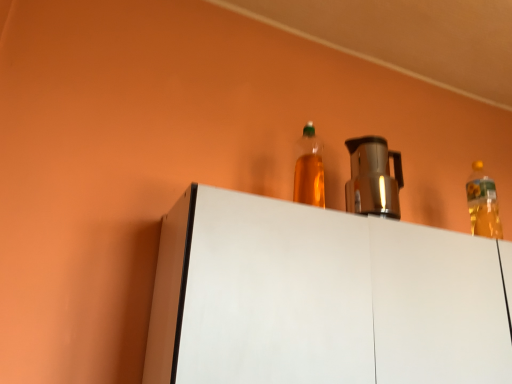
Measure the distance between point [480,272] and camera.

A distance of 3.48 feet exists between point [480,272] and camera.

Where is `translucent yellow bottle at upper right, acting as the first bottle starting from the right`? The image size is (512, 384). translucent yellow bottle at upper right, acting as the first bottle starting from the right is located at coordinates (483, 204).

The height and width of the screenshot is (384, 512). What are the coordinates of `translucent plastic bottle at upper center, placed as the second bottle when sorted from right to left` in the screenshot? It's located at (309, 170).

You are a GUI agent. You are given a task and a screenshot of the screen. Output one action in this format:
    pyautogui.click(x=<x>, y=<y>)
    Task: Click on the metallic silver coffee pot at center
    This screenshot has width=512, height=384.
    Given the screenshot: What is the action you would take?
    [373, 178]

Does white matte cabinet at upper center have a greater height compared to metallic silver coffee pot at center?

Indeed, white matte cabinet at upper center has a greater height compared to metallic silver coffee pot at center.

Does point (202, 262) come farther from viewer compared to point (383, 180)?

No, (202, 262) is in front of (383, 180).

The height and width of the screenshot is (384, 512). Find the location of `appliance above the white matte cabinet at upper center (from the image's perspective)`. appliance above the white matte cabinet at upper center (from the image's perspective) is located at coordinates (373, 178).

Does metallic silver coffee pot at center contain translucent plastic bottle at upper center, which is the 1th bottle from front to back?

Definitely not — translucent plastic bottle at upper center, which is the 1th bottle from front to back, is not inside metallic silver coffee pot at center.

Considering the relative sizes of metallic silver coffee pot at center and translucent plastic bottle at upper center, the first bottle in the left-to-right sequence, in the image provided, is metallic silver coffee pot at center smaller than translucent plastic bottle at upper center, the first bottle in the left-to-right sequence,?

Actually, metallic silver coffee pot at center might be larger than translucent plastic bottle at upper center, the first bottle in the left-to-right sequence.

Which of these two, metallic silver coffee pot at center or translucent plastic bottle at upper center, placed as the second bottle when sorted from right to left, stands shorter?

Standing shorter between the two is metallic silver coffee pot at center.

Is translucent plastic bottle at upper center, the 2th bottle viewed from the back, not inside metallic silver coffee pot at center?

Yes.

From a real-world perspective, is translucent plastic bottle at upper center, the first bottle in the left-to-right sequence, positioned above or below metallic silver coffee pot at center?

In terms of real-world spatial position, translucent plastic bottle at upper center, the first bottle in the left-to-right sequence, is above metallic silver coffee pot at center.

Is translucent plastic bottle at upper center, the 2th bottle viewed from the back, facing towards metallic silver coffee pot at center?

No, translucent plastic bottle at upper center, the 2th bottle viewed from the back, is not aimed at metallic silver coffee pot at center.

Where is `appliance located below the translucent plastic bottle at upper center, which is the 1th bottle from front to back (from the image's perspective)`? The image size is (512, 384). appliance located below the translucent plastic bottle at upper center, which is the 1th bottle from front to back (from the image's perspective) is located at coordinates (373, 178).

Who is taller, metallic silver coffee pot at center or white matte cabinet at upper center?

With more height is white matte cabinet at upper center.

From a real-world perspective, which is physically above, metallic silver coffee pot at center or white matte cabinet at upper center?

metallic silver coffee pot at center.

Locate an element on the screen. The image size is (512, 384). furniture that appears below the metallic silver coffee pot at center (from the image's perspective) is located at coordinates tap(320, 298).

Is metallic silver coffee pot at center a part of translucent yellow bottle at upper right, which is the 2th bottle in left-to-right order?

No, metallic silver coffee pot at center is located outside of translucent yellow bottle at upper right, which is the 2th bottle in left-to-right order.

How distant is translucent yellow bottle at upper right, the 1th bottle viewed from the back, from metallic silver coffee pot at center?

translucent yellow bottle at upper right, the 1th bottle viewed from the back, and metallic silver coffee pot at center are 23.85 inches apart.

Locate an element on the screen. The height and width of the screenshot is (384, 512). appliance on the left of the translucent yellow bottle at upper right, acting as the first bottle starting from the right is located at coordinates [x=373, y=178].

Is translucent yellow bottle at upper right, the second bottle positioned from the front, bigger or smaller than metallic silver coffee pot at center?

Considering their sizes, translucent yellow bottle at upper right, the second bottle positioned from the front, takes up less space than metallic silver coffee pot at center.

Could you tell me if translucent plastic bottle at upper center, which is the 1th bottle from front to back, is facing white matte cabinet at upper center?

No, translucent plastic bottle at upper center, which is the 1th bottle from front to back, is not turned towards white matte cabinet at upper center.

Looking at this image, does translucent plastic bottle at upper center, the 2th bottle viewed from the back, appear on the left side of white matte cabinet at upper center?

Yes, translucent plastic bottle at upper center, the 2th bottle viewed from the back, is to the left of white matte cabinet at upper center.

Is white matte cabinet at upper center completely or partially inside translucent plastic bottle at upper center, placed as the second bottle when sorted from right to left?

No, white matte cabinet at upper center is located outside of translucent plastic bottle at upper center, placed as the second bottle when sorted from right to left.

From a real-world perspective, which object rests below the other?

white matte cabinet at upper center, from a real-world perspective.

Could you tell me if translucent plastic bottle at upper center, the 2th bottle viewed from the back, is facing translucent yellow bottle at upper right, acting as the first bottle starting from the right?

No, translucent plastic bottle at upper center, the 2th bottle viewed from the back, is not turned towards translucent yellow bottle at upper right, acting as the first bottle starting from the right.

Which of these two, translucent plastic bottle at upper center, placed as the second bottle when sorted from right to left, or translucent yellow bottle at upper right, the second bottle positioned from the front, is bigger?

translucent plastic bottle at upper center, placed as the second bottle when sorted from right to left.

Is translucent plastic bottle at upper center, which is the 1th bottle from front to back, surrounding translucent yellow bottle at upper right, the 1th bottle viewed from the back?

No, translucent plastic bottle at upper center, which is the 1th bottle from front to back, does not contain translucent yellow bottle at upper right, the 1th bottle viewed from the back.

Relative to translucent yellow bottle at upper right, which is the 2th bottle in left-to-right order, is translucent plastic bottle at upper center, the 2th bottle viewed from the back, in front or behind?

translucent plastic bottle at upper center, the 2th bottle viewed from the back, is in front of translucent yellow bottle at upper right, which is the 2th bottle in left-to-right order.

This screenshot has height=384, width=512. There is a white matte cabinet at upper center. In order to click on appliance above it (from a real-world perspective) in this screenshot , I will do `click(373, 178)`.

This screenshot has width=512, height=384. I want to click on appliance on the right of translucent plastic bottle at upper center, which is the 1th bottle from front to back, so click(x=373, y=178).

Considering their positions, is translucent yellow bottle at upper right, the 1th bottle viewed from the back, positioned further to white matte cabinet at upper center than translucent plastic bottle at upper center, the first bottle in the left-to-right sequence?

translucent yellow bottle at upper right, the 1th bottle viewed from the back, is positioned further to the anchor white matte cabinet at upper center.

Considering their positions, is translucent yellow bottle at upper right, acting as the first bottle starting from the right, positioned closer to metallic silver coffee pot at center than white matte cabinet at upper center?

The object closer to metallic silver coffee pot at center is translucent yellow bottle at upper right, acting as the first bottle starting from the right.

Which object lies further to the anchor point translucent yellow bottle at upper right, acting as the first bottle starting from the right, white matte cabinet at upper center or metallic silver coffee pot at center?

metallic silver coffee pot at center lies further to translucent yellow bottle at upper right, acting as the first bottle starting from the right, than the other object.

In the scene shown: When comparing their distances from metallic silver coffee pot at center, does translucent yellow bottle at upper right, the second bottle positioned from the front, or translucent plastic bottle at upper center, the first bottle in the left-to-right sequence, seem closer?

Based on the image, translucent yellow bottle at upper right, the second bottle positioned from the front, appears to be nearer to metallic silver coffee pot at center.

Looking at the image, which one is located closer to translucent yellow bottle at upper right, which is the 2th bottle in left-to-right order, metallic silver coffee pot at center or translucent plastic bottle at upper center, which is the 1th bottle from front to back?

translucent plastic bottle at upper center, which is the 1th bottle from front to back, lies closer to translucent yellow bottle at upper right, which is the 2th bottle in left-to-right order, than the other object.

Estimate the real-world distances between objects in this image. Which object is further from white matte cabinet at upper center, translucent plastic bottle at upper center, placed as the second bottle when sorted from right to left, or metallic silver coffee pot at center?

→ The object further to white matte cabinet at upper center is metallic silver coffee pot at center.

Looking at the image, which one is located further to metallic silver coffee pot at center, white matte cabinet at upper center or translucent plastic bottle at upper center, placed as the second bottle when sorted from right to left?

white matte cabinet at upper center is further to metallic silver coffee pot at center.

Considering their positions, is translucent plastic bottle at upper center, which is the 1th bottle from front to back, positioned closer to metallic silver coffee pot at center than translucent yellow bottle at upper right, the 1th bottle viewed from the back?

Among the two, translucent yellow bottle at upper right, the 1th bottle viewed from the back, is located nearer to metallic silver coffee pot at center.

Locate an element on the screen. This screenshot has width=512, height=384. furniture located between translucent plastic bottle at upper center, placed as the second bottle when sorted from right to left, and translucent yellow bottle at upper right, which is the 2th bottle in left-to-right order, in the left-right direction is located at coordinates (320, 298).

What are the coordinates of `appliance between white matte cabinet at upper center and translucent yellow bottle at upper right, acting as the first bottle starting from the right, along the z-axis` in the screenshot? It's located at (373, 178).

Find the location of a particular element. This screenshot has height=384, width=512. appliance between translucent plastic bottle at upper center, which is the 1th bottle from front to back, and translucent yellow bottle at upper right, the 1th bottle viewed from the back, in the horizontal direction is located at coordinates (373, 178).

Locate an element on the screen. This screenshot has width=512, height=384. appliance that lies between translucent plastic bottle at upper center, placed as the second bottle when sorted from right to left, and white matte cabinet at upper center from top to bottom is located at coordinates (373, 178).